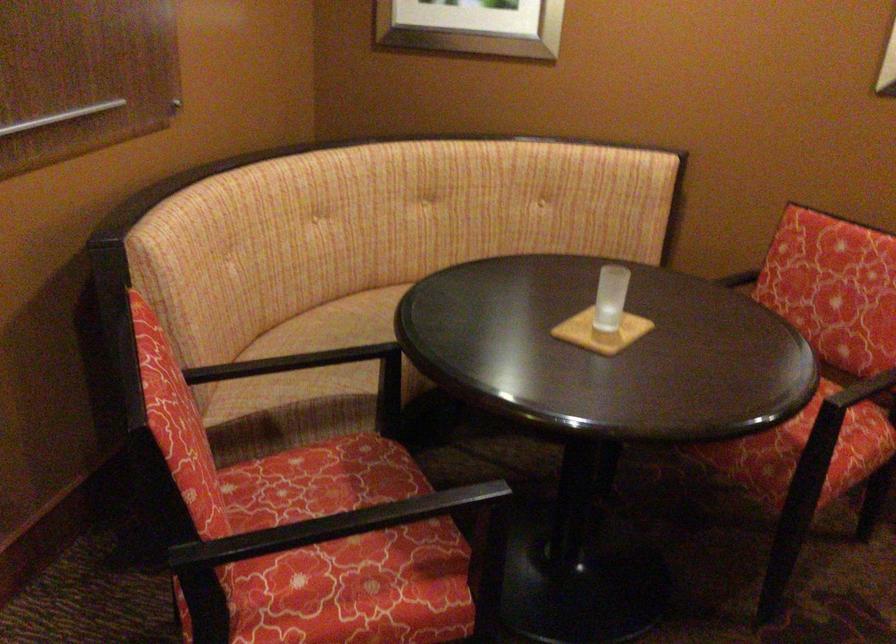
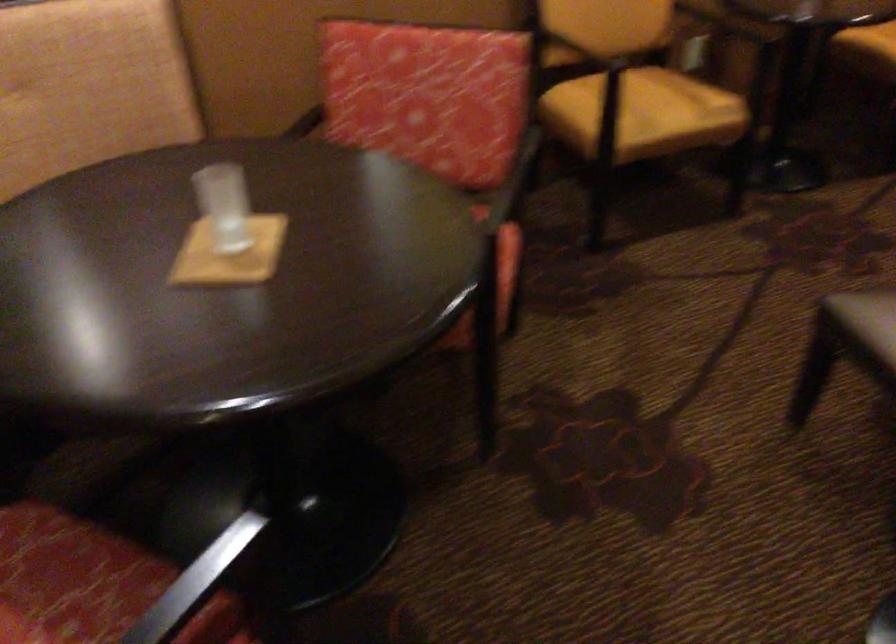
Consider the image. Based on the continuous images, in which direction is the camera rotating?

The rotation direction of the camera is right-down.